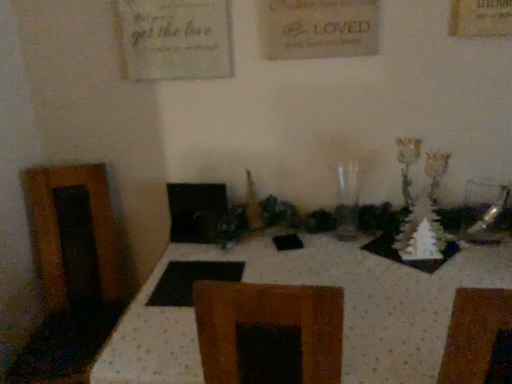
Question: From a real-world perspective, is transparent glass vase at center physically located above or below white dotted fabric at center?

Choices:
 (A) above
 (B) below

Answer: (A)

Question: Looking at their shapes, would you say transparent glass vase at center is wider or thinner than white dotted fabric at center?

Choices:
 (A) thin
 (B) wide

Answer: (A)

Question: Does point (350, 220) appear closer or farther from the camera than point (285, 269)?

Choices:
 (A) farther
 (B) closer

Answer: (A)

Question: From the image's perspective, is white dotted fabric at center located above or below transparent glass vase at center?

Choices:
 (A) below
 (B) above

Answer: (A)

Question: In the image, is white dotted fabric at center on the left side or the right side of transparent glass vase at center?

Choices:
 (A) right
 (B) left

Answer: (B)

Question: Does point (348, 292) appear closer or farther from the camera than point (336, 188)?

Choices:
 (A) farther
 (B) closer

Answer: (B)

Question: Would you say white dotted fabric at center is inside or outside transparent glass vase at center?

Choices:
 (A) inside
 (B) outside

Answer: (B)